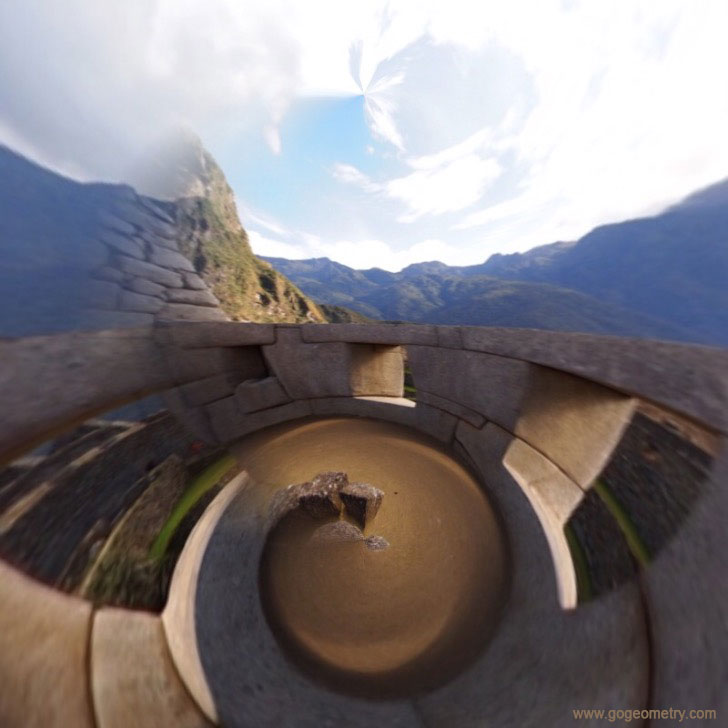
In order to click on top of ledge in this screenshot , I will do `click(676, 349)`, `click(430, 331)`, `click(288, 336)`, `click(212, 336)`, `click(110, 349)`.